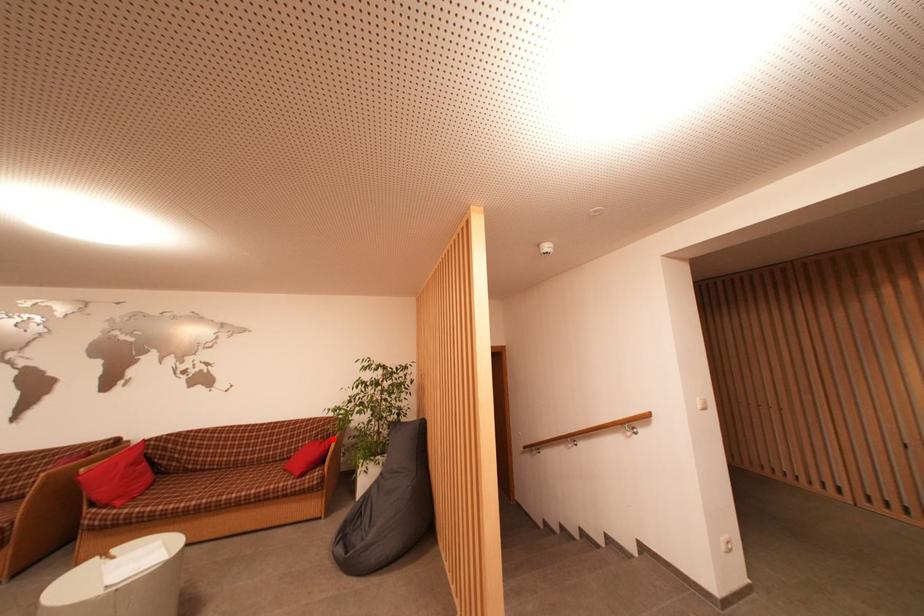
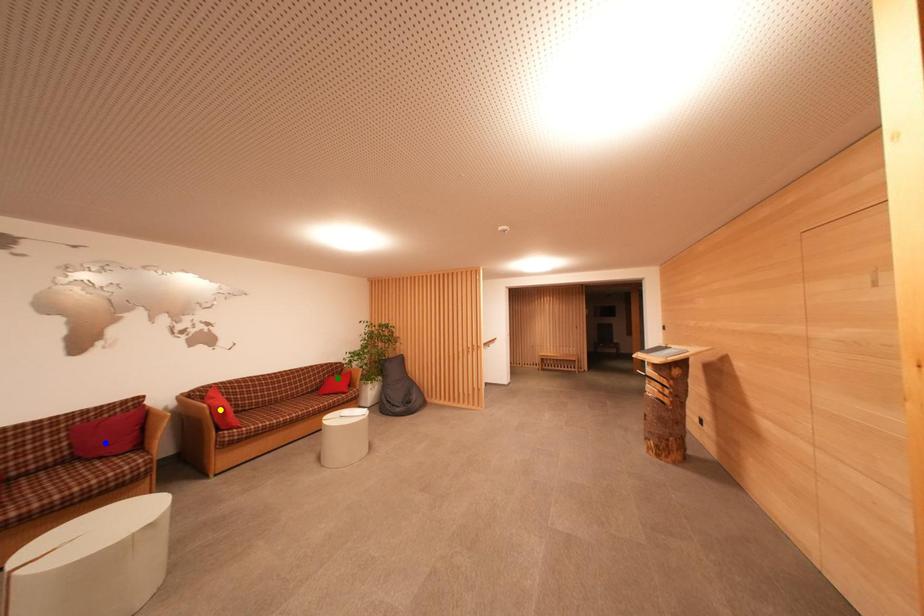
Question: I am providing you with two images of the same scene from different viewpoints. A red point is marked on the first image. You are given multiple points on the second image. Which point in image 2 is actually the same real-world point as the red point in image 1?

Choices:
 (A) yellow point
 (B) blue point
 (C) green point

Answer: (C)